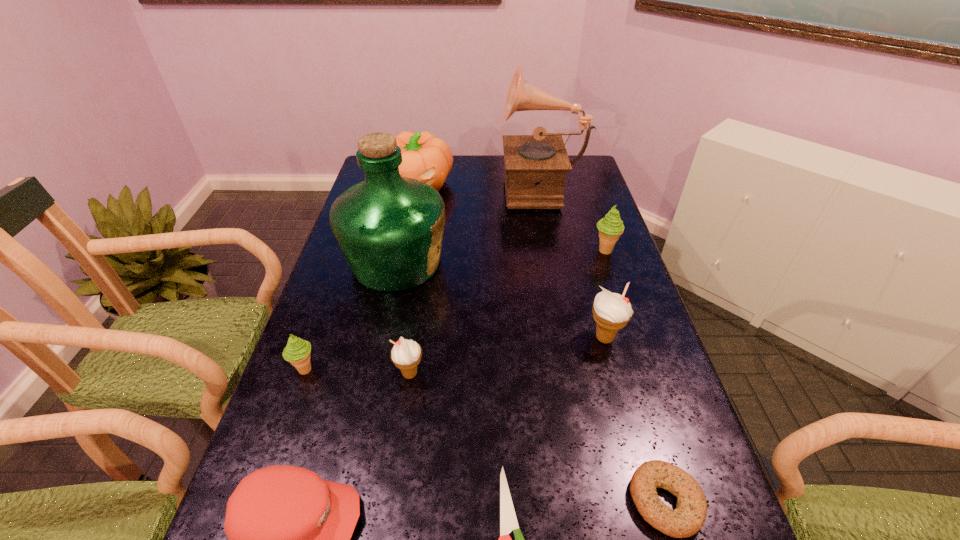
This screenshot has width=960, height=540. I want to click on unoccupied position between the second icecream from left to right and the nearer green icecream, so click(x=357, y=372).

Find the location of a particular element. This screenshot has width=960, height=540. vacant area that lies between the bigger green icecream and the smaller white icecream is located at coordinates (507, 312).

Where is `free space between the pumpkin and the farther green icecream`? Image resolution: width=960 pixels, height=540 pixels. free space between the pumpkin and the farther green icecream is located at coordinates (511, 218).

The image size is (960, 540). I want to click on free space between the green liquor and the farther green icecream, so click(500, 256).

Locate an element on the screen. This screenshot has height=540, width=960. vacant region between the nearer white icecream and the green liquor is located at coordinates (403, 318).

The height and width of the screenshot is (540, 960). What are the coordinates of `free space between the farthest icecream and the record player` in the screenshot? It's located at (573, 219).

The width and height of the screenshot is (960, 540). I want to click on object that is the sixth closest to the liquor, so click(x=610, y=227).

Identify which object is the closest to the green liquor. Please provide its 2D coordinates. Your answer should be formatted as a tuple, i.e. [(x, y)], where the tuple contains the x and y coordinates of a point satisfying the conditions above.

[(426, 158)]

Select which icecream is the third closest to the cap. Please provide its 2D coordinates. Your answer should be formatted as a tuple, i.e. [(x, y)], where the tuple contains the x and y coordinates of a point satisfying the conditions above.

[(611, 311)]

Image resolution: width=960 pixels, height=540 pixels. In order to click on icecream object that ranks as the second closest to the liquor in this screenshot , I will do `click(406, 354)`.